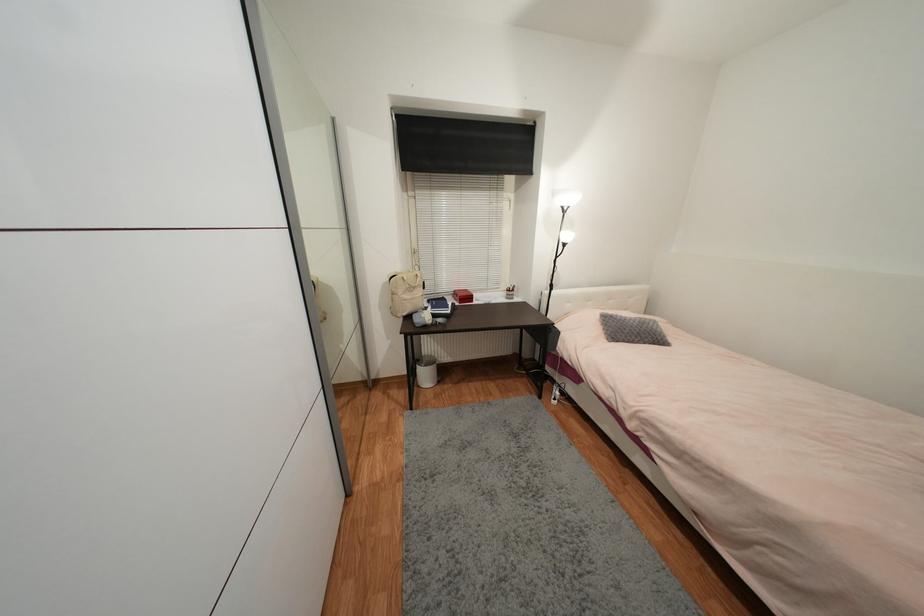
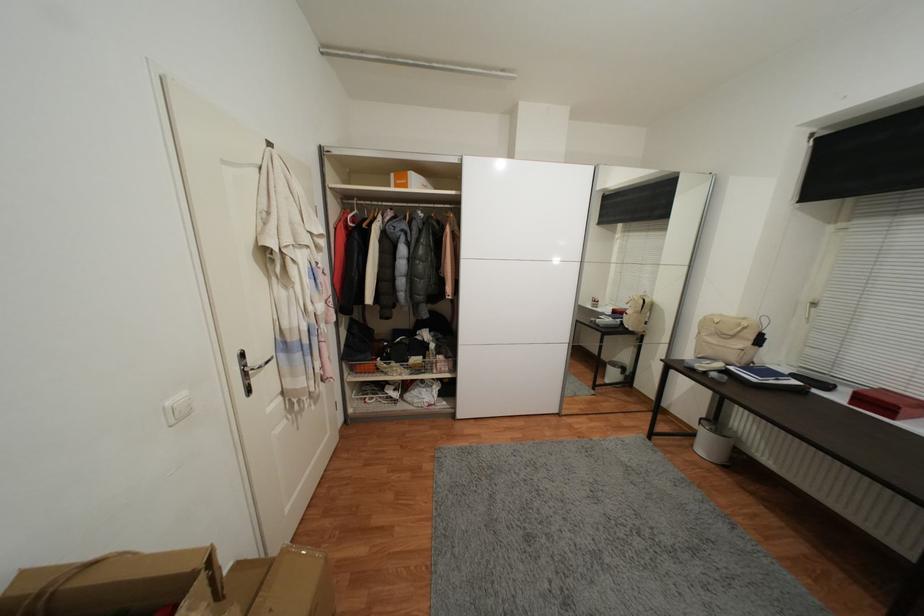
Find the pixel in the second image that matches pixel 454 313 in the first image.

(759, 381)